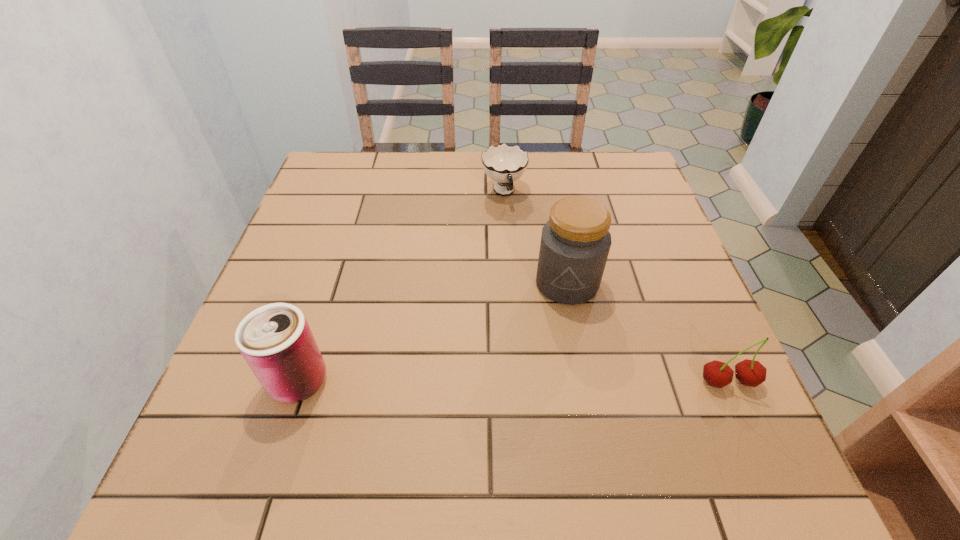
Locate an element on the screen. vacant spot on the desktop that is between the can and the rightmost object and is positioned on the surface of the third nearest object near the warning symbol is located at coordinates (536, 381).

Locate an element on the screen. This screenshot has width=960, height=540. free space on the desktop that is between the can and the rightmost object and is positioned on the side of the farthest object with the handle is located at coordinates (568, 381).